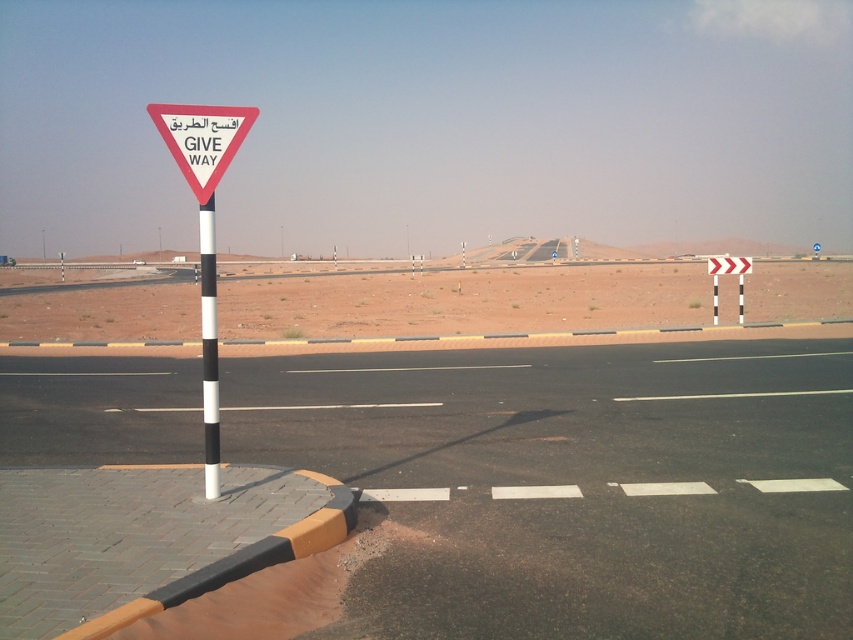
Question: Which of these objects is positioned farthest from the black and white striped pole at left?

Choices:
 (A) black asphalt highway at left
 (B) white triangular sign at center

Answer: (B)

Question: Does desert sand at center have a lesser width compared to white triangular sign at center?

Choices:
 (A) yes
 (B) no

Answer: (B)

Question: Does black asphalt highway at left appear under black and white striped pole at left?

Choices:
 (A) no
 (B) yes

Answer: (B)

Question: Estimate the real-world distances between objects in this image. Which object is closer to the black and white striped pole at left?

Choices:
 (A) white triangular sign at center
 (B) desert sand at center
 (C) black asphalt highway at left

Answer: (C)

Question: Which object is positioned farthest from the black asphalt highway at left?

Choices:
 (A) black and white striped pole at left
 (B) white triangular sign at center

Answer: (B)

Question: Is desert sand at center to the right of white triangular sign at center from the viewer's perspective?

Choices:
 (A) yes
 (B) no

Answer: (A)